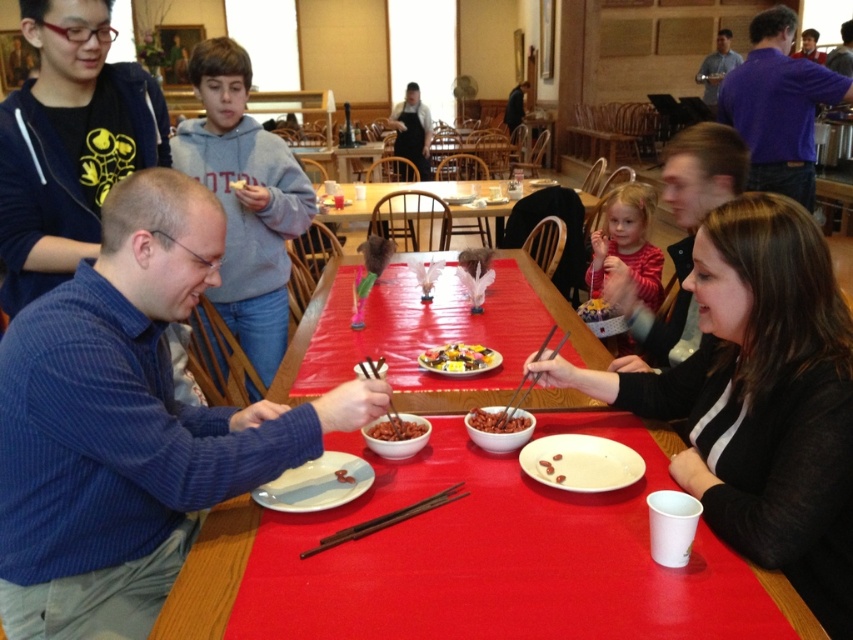
Consider the image. You are a photographer holding a camera and want to place your matte black hoodie at upper left out of the frame. If the camera can capture a 5 feet wide area, will the hoodie be in the shot?

The matte black hoodie at upper left and camera are 5.05 feet apart from each other. Since the camera can only capture a 5 feet wide area, the hoodie is slightly outside the frame and will not be in the shot.

You are standing at the table and want to pick up both items located at point (795, 144) and point (639, 225). Which item should you reach for first if you want to grab the one closer to you?

You should reach for point (639, 225) first because it is closer to you than point (795, 144), which is further away.

What is located at the point with coordinates (434, 333) in the image?

The point at (434, 333) is covered by the smooth red table at center.